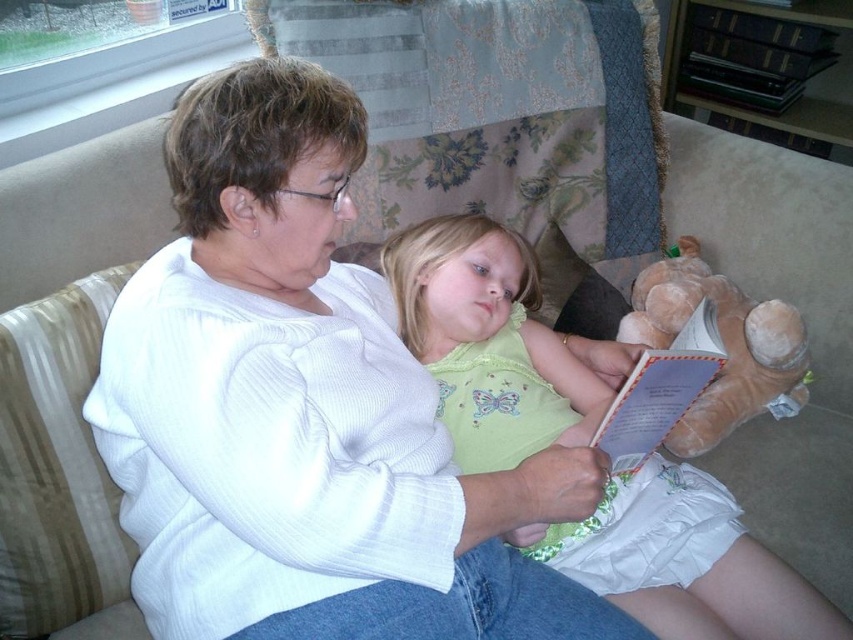
Where is the white ribbed sweater at center located in the image?

The white ribbed sweater at center is located at point coordinates of (305, 410).

You are a photographer standing in front of the scene. You want to capture a closeup shot of the light green fabric dress at center. What is the minimum distance you need to maintain from the dress to avoid blurring the image?

The minimum distance you need to maintain from the light green fabric dress at center is 35.85 inches to avoid blurring the image.